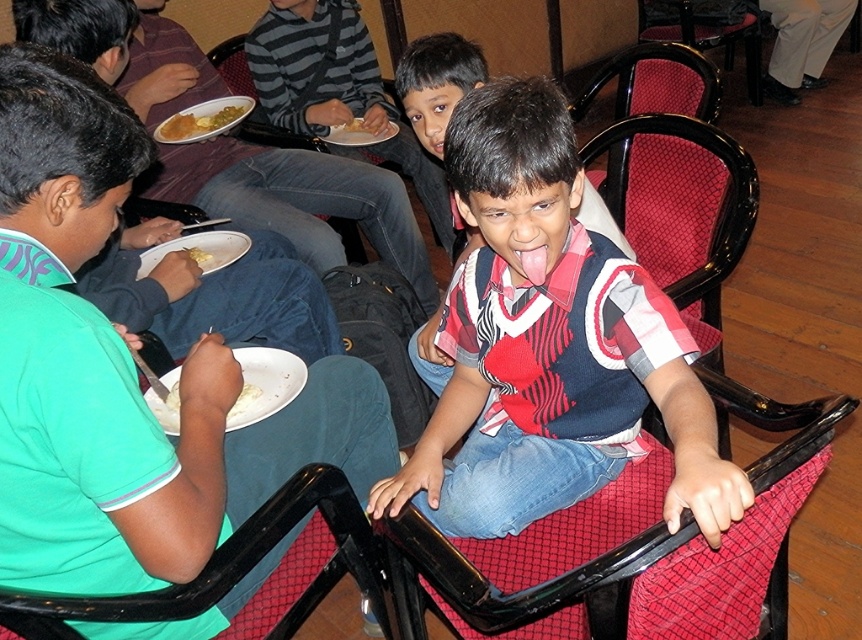
Between black plastic chair at center and yellow matte bread at center, which one appears on the left side from the viewer's perspective?

yellow matte bread at center

Which of these two, black plastic chair at center or yellow matte bread at center, stands shorter?

Standing shorter between the two is yellow matte bread at center.

I want to click on black plastic chair at center, so click(x=255, y=100).

Which is behind, point (695, 26) or point (167, 116)?

Point (695, 26)

Can you confirm if velvet-like red chair at center is positioned to the right of yellow matte rice at upper left?

Correct, you'll find velvet-like red chair at center to the right of yellow matte rice at upper left.

At what (x,y) coordinates should I click in order to perform the action: click on velvet-like red chair at center. Please return your answer as a coordinate pair (x, y). This screenshot has height=640, width=862. Looking at the image, I should click on (706, 35).

Between red mesh chair at center and yellow matte rice at upper left, which one has less height?

With less height is yellow matte rice at upper left.

What do you see at coordinates (544, 557) in the screenshot? I see `red mesh chair at center` at bounding box center [544, 557].

Locate an element on the screen. This screenshot has width=862, height=640. red mesh chair at center is located at coordinates (544, 557).